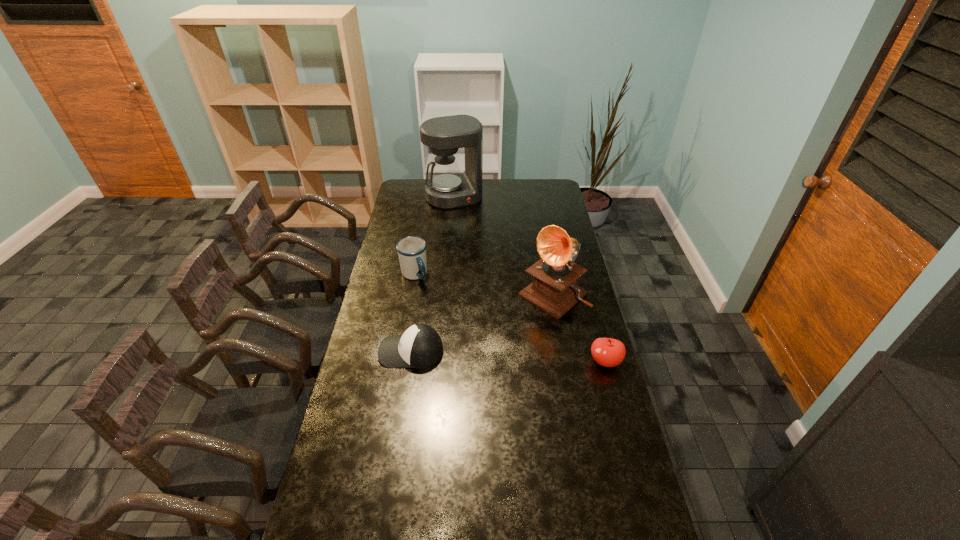
At what (x,y) coordinates should I click in order to perform the action: click on free space that is in between the coffee maker and the third shortest object. Please return your answer as a coordinate pair (x, y). Looking at the image, I should click on (434, 235).

Find the location of a particular element. vacant space that's between the apple and the second tallest object is located at coordinates (579, 328).

Locate an element on the screen. Image resolution: width=960 pixels, height=540 pixels. free space between the second tallest object and the cap is located at coordinates (482, 323).

Find the location of `free space between the farthest object and the phonograph record`. free space between the farthest object and the phonograph record is located at coordinates (504, 246).

Locate an element on the screen. empty space between the apple and the mug is located at coordinates (510, 318).

Select which object is the fourth closest to the cap. Please provide its 2D coordinates. Your answer should be formatted as a tuple, i.e. [(x, y)], where the tuple contains the x and y coordinates of a point satisfying the conditions above.

[(448, 188)]

In order to click on object that is the fourth closest to the farthest object in this screenshot , I will do `click(607, 352)`.

You are a GUI agent. You are given a task and a screenshot of the screen. Output one action in this format:
    pyautogui.click(x=<x>, y=<y>)
    Task: Click on the blank space that satisfies the following two spatial constraints: 1. on the front side of the phonograph record; 2. on the left side of the apple
    The width and height of the screenshot is (960, 540).
    Given the screenshot: What is the action you would take?
    pyautogui.click(x=565, y=361)

Image resolution: width=960 pixels, height=540 pixels. What are the coordinates of `vacant point that satisfies the following two spatial constraints: 1. on the front side of the phonograph record; 2. on the left side of the apple` in the screenshot? It's located at [x=565, y=361].